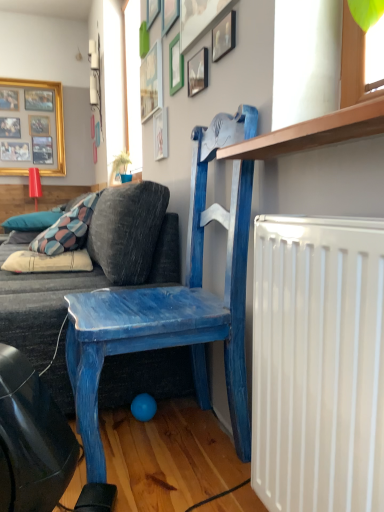
Question: From a real-world perspective, is patterned fabric pillow at lower left, acting as the 2th pillow starting from the front, physically located above or below blue painted wood chair at upper center?

Choices:
 (A) below
 (B) above

Answer: (B)

Question: From the image's perspective, is patterned fabric pillow at lower left, which appears as the first pillow when viewed from the left, located above or below blue painted wood chair at upper center?

Choices:
 (A) below
 (B) above

Answer: (B)

Question: Estimate the real-world distances between objects in this image. Which object is closer to the white cotton pillow at lower left, marked as the 2th pillow in a back-to-front arrangement?

Choices:
 (A) gold metallic picture frame at upper left, which is the first picture frame in back-to-front order
 (B) wooden picture frame at upper center, the second picture frame from the back
 (C) wooden picture frame at upper center, which is the first picture frame from right to left
 (D) blue painted wood chair at upper center
 (E) wooden picture frame at upper center, placed as the 4th picture frame when sorted from back to front

Answer: (D)

Question: Considering the real-world distances, which object is closest to the wooden picture frame at upper center, the 7th picture frame when ordered from left to right?

Choices:
 (A) white cotton pillow at lower left, which ranks as the 1th pillow in front-to-back order
 (B) matte white picture frame at upper center, which ranks as the third picture frame in right-to-left order
 (C) wooden picture frame at upper center, which appears as the third picture frame when viewed from the left
 (D) wooden picture frame at upper center, acting as the eighth picture frame starting from the back
 (E) green matte picture frame at upper center, the 5th picture frame in the left-to-right sequence

Answer: (D)